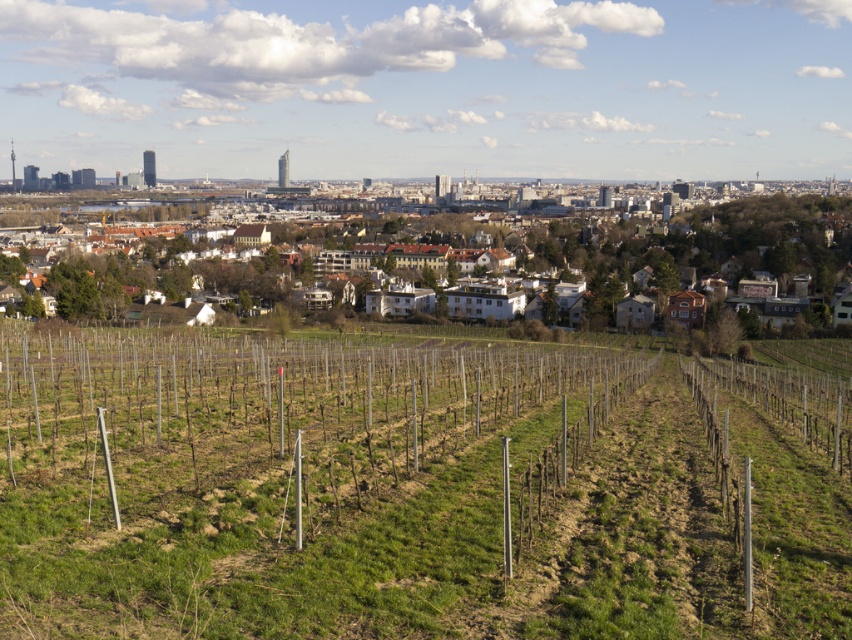
Describe the element at coordinates (404, 490) in the screenshot. The width and height of the screenshot is (852, 640). I see `green grassy hillside at center` at that location.

Can you confirm if green grassy hillside at center is smaller than white textured buildings at center?

Yes, green grassy hillside at center is smaller than white textured buildings at center.

Who is more distant from viewer, (229, 419) or (772, 308)?

Positioned behind is point (772, 308).

What are the coordinates of `green grassy hillside at center` in the screenshot? It's located at (404, 490).